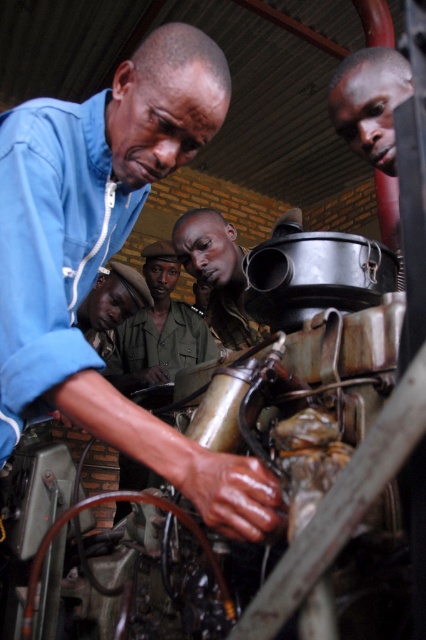
You are a safety inspector assessing the scene. You notice the smooth skin face at upper right and the metallic gray pipe at center. Which object has a smaller width?

The smooth skin face at upper right has a smaller width than the metallic gray pipe at center.

You are a maintenance worker who needs to hand a tool to your colleague. You are currently standing near the blue matte shirt at upper left. Your colleague is wearing the green uniform at center. The tool you have is 1.5 meters long. Can you safely hand the tool to your colleague without moving closer?

The distance between the blue matte shirt at upper left and the green uniform at center is 1.73 meters. Since the tool is only 1.5 meters long, it is not long enough to reach your colleague who is 1.73 meters away. You need to move closer to hand the tool safely.

You are standing at the center of the scene and want to reach point A at point (356, 131) and point B at point (204, 280). Which point is closer to you?

Point A at point (356, 131) is closer to you because it is in front of point B at point (204, 280).